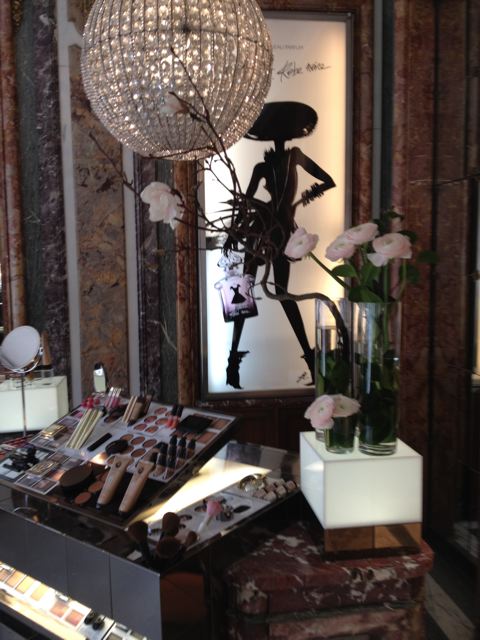
You are a GUI agent. You are given a task and a screenshot of the screen. Output one action in this format:
    pyautogui.click(x=<x>, y=<y>)
    Task: Click on the mirror
    
    Given the screenshot: What is the action you would take?
    pyautogui.click(x=22, y=348)